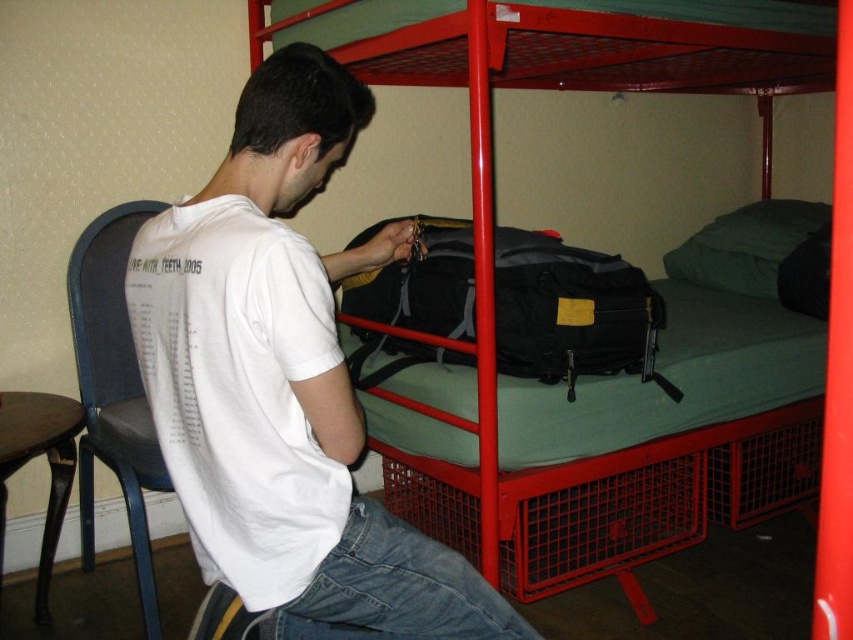
Can you confirm if black fabric backpack at center is positioned below brown wood stool at lower left?

Actually, black fabric backpack at center is above brown wood stool at lower left.

Between point (480, 68) and point (57, 536), which one is positioned in front?

Point (480, 68)

This screenshot has height=640, width=853. I want to click on black fabric backpack at center, so click(692, 432).

Which is above, white cotton t-shirt at center or black fabric backpack at center?

black fabric backpack at center is higher up.

Can you confirm if white cotton t-shirt at center is shorter than black fabric backpack at center?

Correct, white cotton t-shirt at center is not as tall as black fabric backpack at center.

Is point (281, 186) positioned in front of point (589, 394)?

Yes, it is.

Locate an element on the screen. This screenshot has height=640, width=853. white cotton t-shirt at center is located at coordinates (283, 385).

Who is positioned more to the left, white cotton t-shirt at center or brown wood stool at lower left?

Positioned to the left is brown wood stool at lower left.

The image size is (853, 640). Describe the element at coordinates (283, 385) in the screenshot. I see `white cotton t-shirt at center` at that location.

You are a GUI agent. You are given a task and a screenshot of the screen. Output one action in this format:
    pyautogui.click(x=<x>, y=<y>)
    Task: Click on the white cotton t-shirt at center
    The image size is (853, 640).
    Given the screenshot: What is the action you would take?
    pyautogui.click(x=283, y=385)

Identify the location of white cotton t-shirt at center. (283, 385).